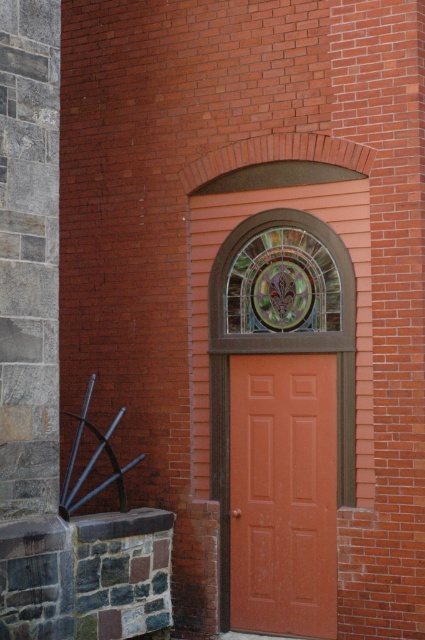
In the scene shown: You are standing in front of a building with a mix of red brick and gray stone. You see a matte orange door at center and a stained glass window at center. Which object is positioned more to the left?

The matte orange door at center is positioned more to the left than the stained glass window at center.

You are an architect designing a new building and want to incorporate both a matte orange door at center and a stained glass window at center. Based on the image, which object should you make taller to maintain the original design proportions?

To maintain the original design proportions, the matte orange door at center should be made taller than the stained glass window at center, as it was in the original image.

You are a painter who needs to decide which object to paint first between the matte orange door at center and the stained glass window at center. Based on their widths, which one should you choose if you want to paint the wider one first?

The stained glass window at center is wider than the matte orange door at center, so you should paint the stained glass window at center first.